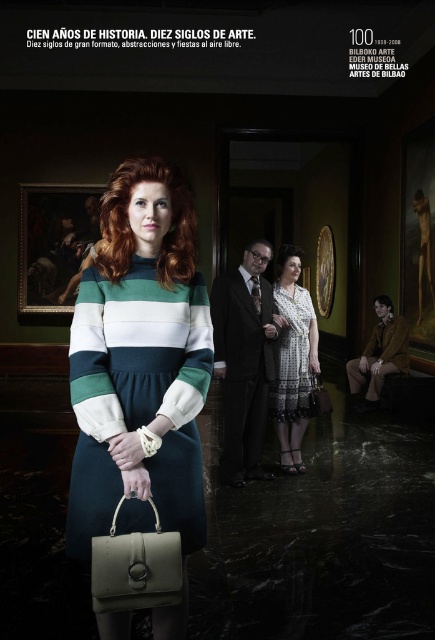
Question: Which point is closer to the camera taking this photo?

Choices:
 (A) (140, 545)
 (B) (187, 516)

Answer: (A)

Question: Is dark gray suit at center positioned before matte olive-green handbag at center?

Choices:
 (A) yes
 (B) no

Answer: (B)

Question: Which point is closer to the camera taking this photo?

Choices:
 (A) (82, 548)
 (B) (77, 205)

Answer: (A)

Question: From the image, what is the correct spatial relationship of green wool dress at center in relation to dark gray suit at center?

Choices:
 (A) above
 (B) below

Answer: (A)

Question: Which point is farther from the camera taking this photo?

Choices:
 (A) (261, 269)
 (B) (87, 465)

Answer: (A)

Question: Is white lace dress at center positioned before matte olive-green handbag at center?

Choices:
 (A) no
 (B) yes

Answer: (A)